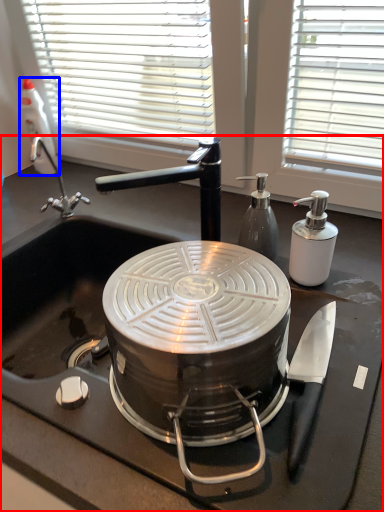
Question: Among these objects, which one is farthest to the camera, sink (highlighted by a red box) or bottle (highlighted by a blue box)?

Choices:
 (A) sink
 (B) bottle

Answer: (B)